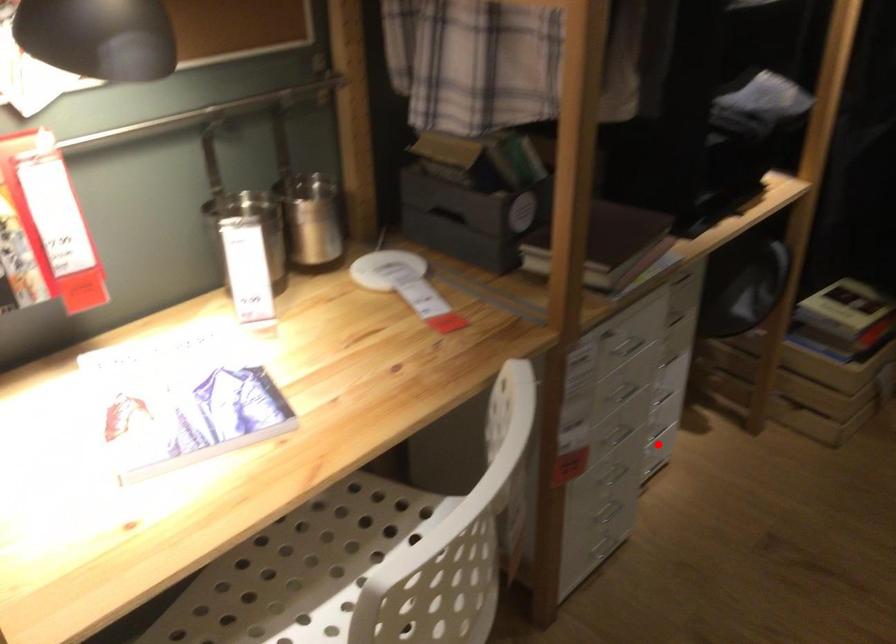
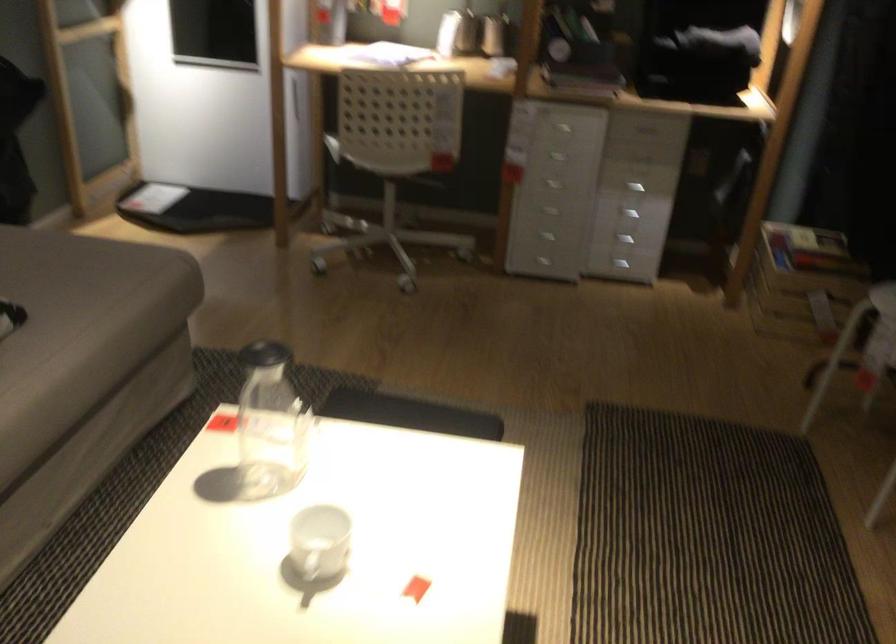
Find the pixel in the second image that matches the highlighted location in the first image.

(625, 240)